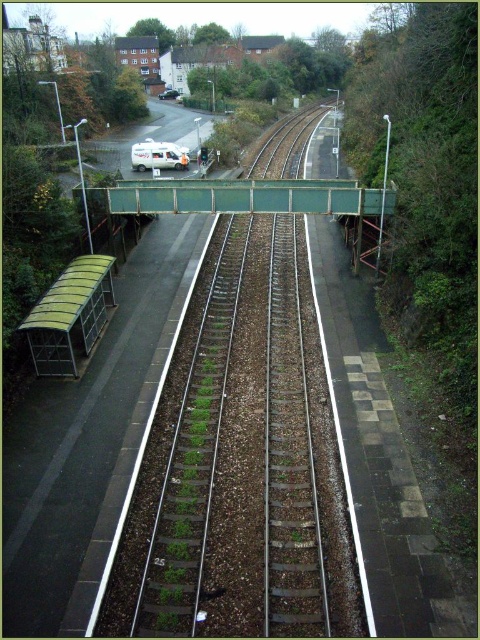
From the picture: You are a passenger waiting at the railway station and need to board a train that arrives from the direction of the green metallic bridge at center. From your current position near the white matte van at upper center, which direction should you move to reach the correct boarding platform?

Since the green metallic bridge at center is positioned to the right of the white matte van at upper center, you should move to your right to reach the boarding platform in the direction of the bridge.

You are a delivery driver who needs to park your white matte van at upper center near the green metallic bridge at center. The parking space you choose must be within 15 meters of the bridge. Can you park your van in this location based on the scene?

The green metallic bridge at center and white matte van at upper center are 16.98 meters apart from each other. Since the required distance is within 15 meters, the van cannot be parked here as it exceeds the allowed distance.

Consider the image. You are standing at the railway station and want to determine the relative positions of two points marked on the platform. The first point is at coordinates point (264, 180), and the second is at point (156, 147). Which of these points is nearer to your current position?

Point (264, 180) is closer to the viewer than point (156, 147), so the first point is nearer to your current position.